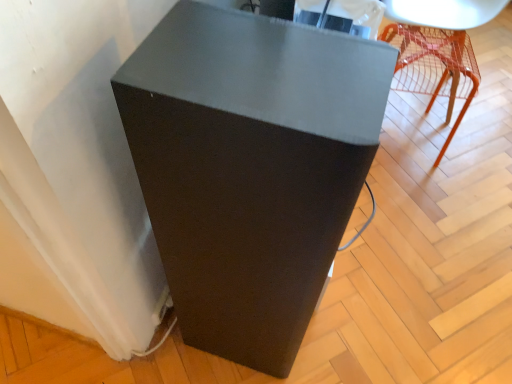
Question: Considering their positions, is matte black speaker at lower left, which appears as the 1th furniture when viewed from the left, located in front of or behind translucent orange chair at upper right, the second furniture positioned from the left?

Choices:
 (A) behind
 (B) front

Answer: (B)

Question: Is matte black speaker at lower left, which is the second furniture from back to front, bigger or smaller than translucent orange chair at upper right, the second furniture in the front-to-back sequence?

Choices:
 (A) big
 (B) small

Answer: (A)

Question: Would you say matte black speaker at lower left, marked as the 2th furniture in a right-to-left arrangement, is inside or outside translucent orange chair at upper right, the second furniture in the front-to-back sequence?

Choices:
 (A) outside
 (B) inside

Answer: (A)

Question: Is point (455, 130) positioned closer to the camera than point (279, 100)?

Choices:
 (A) closer
 (B) farther

Answer: (B)

Question: Is translucent orange chair at upper right, placed as the first furniture when sorted from top to bottom, situated inside matte black speaker at lower left, the 1th furniture when ordered from bottom to top, or outside?

Choices:
 (A) inside
 (B) outside

Answer: (B)

Question: Visually, is translucent orange chair at upper right, the second furniture positioned from the left, positioned to the left or to the right of matte black speaker at lower left, marked as the 2th furniture in a right-to-left arrangement?

Choices:
 (A) right
 (B) left

Answer: (A)

Question: In terms of width, does translucent orange chair at upper right, which appears as the first furniture when viewed from the back, look wider or thinner when compared to matte black speaker at lower left, the 1th furniture when ordered from bottom to top?

Choices:
 (A) thin
 (B) wide

Answer: (A)